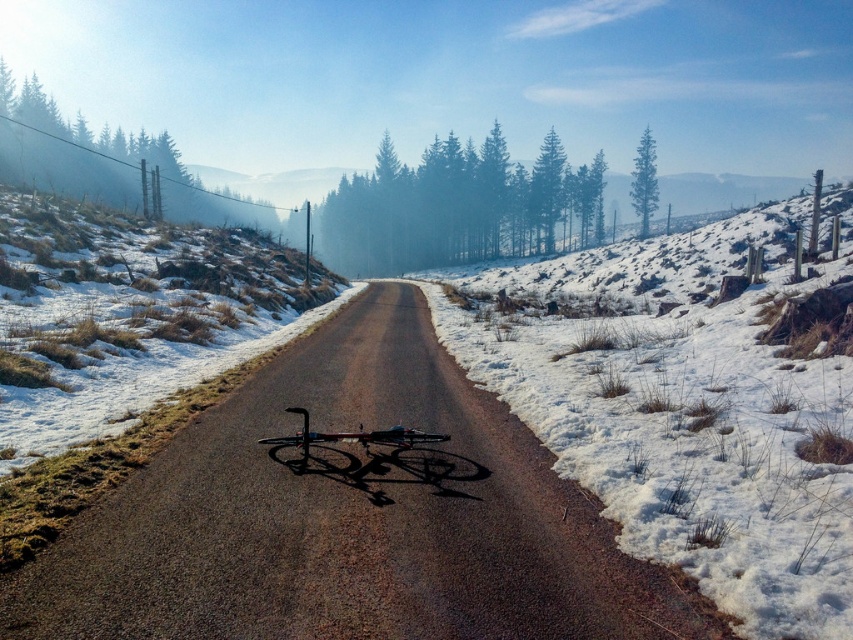
Question: Is dirt/gravel road at center to the right of shiny metallic bicycle at center from the viewer's perspective?

Choices:
 (A) yes
 (B) no

Answer: (B)

Question: Among these objects, which one is nearest to the camera?

Choices:
 (A) dirt/gravel road at center
 (B) shiny metallic bicycle at center

Answer: (A)

Question: Considering the relative positions of dirt/gravel road at center and white fluffy snow at right in the image provided, where is dirt/gravel road at center located with respect to white fluffy snow at right?

Choices:
 (A) right
 (B) left

Answer: (B)

Question: Which of the following is the farthest from the observer?

Choices:
 (A) (695, 300)
 (B) (341, 436)
 (C) (231, 464)

Answer: (A)

Question: Can you confirm if dirt/gravel road at center is positioned to the left of white fluffy snow at right?

Choices:
 (A) no
 (B) yes

Answer: (B)

Question: Which of the following is the closest to the observer?

Choices:
 (A) dirt/gravel road at center
 (B) shiny metallic bicycle at center
 (C) white fluffy snow at right

Answer: (A)